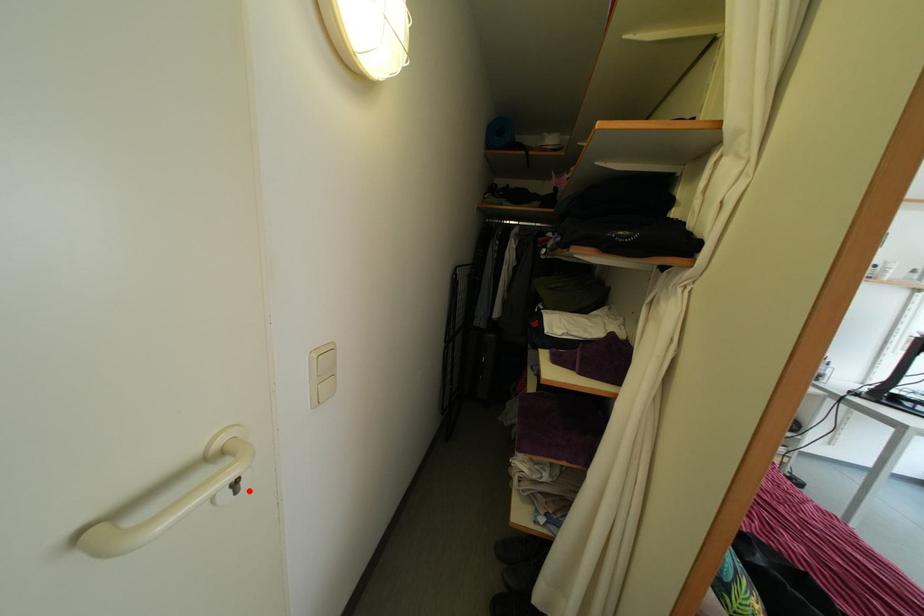
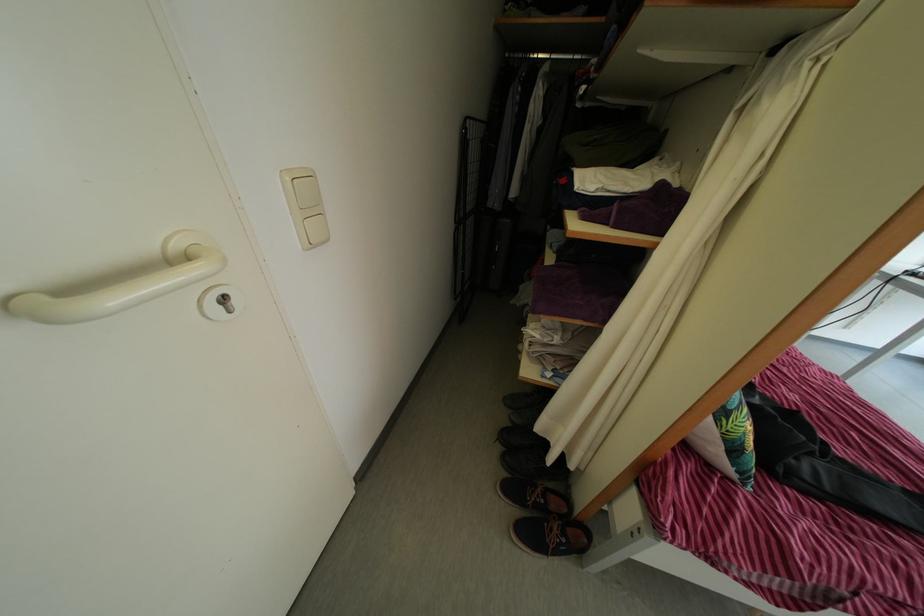
Where in the second image is the point corresponding to the highlighted location from the first image?

(239, 310)